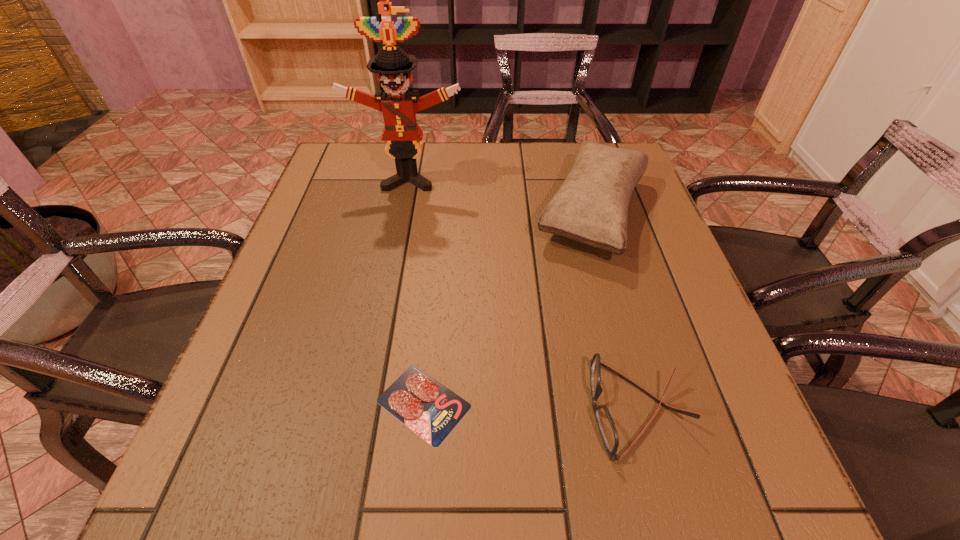
The image size is (960, 540). I want to click on nutcracker, so (x=403, y=135).

At what (x,y) coordinates should I click in order to perform the action: click on the second tallest object. Please return your answer as a coordinate pair (x, y). The height and width of the screenshot is (540, 960). Looking at the image, I should click on pos(591,207).

Where is `the second shortest object`? This screenshot has height=540, width=960. the second shortest object is located at coordinates (608, 432).

Identify the location of the shortest object. (430, 409).

Image resolution: width=960 pixels, height=540 pixels. What are the coordinates of `vacant space located on the front-facing side of the nutcracker` in the screenshot? It's located at (395, 252).

You are a GUI agent. You are given a task and a screenshot of the screen. Output one action in this format:
    pyautogui.click(x=<x>, y=<y>)
    Task: Click on the vacant space situated on the front of the third shortest object
    This screenshot has height=540, width=960.
    Given the screenshot: What is the action you would take?
    pyautogui.click(x=628, y=333)

This screenshot has height=540, width=960. I want to click on vacant area situated on the front-facing side of the third tallest object, so pos(457,408).

The height and width of the screenshot is (540, 960). I want to click on vacant space located on the front-facing side of the third tallest object, so click(475, 408).

Locate an element on the screen. The height and width of the screenshot is (540, 960). vacant position located 0.150m on the front-facing side of the third tallest object is located at coordinates (500, 408).

The width and height of the screenshot is (960, 540). I want to click on vacant point located 0.110m on the right of the shortest object, so click(538, 403).